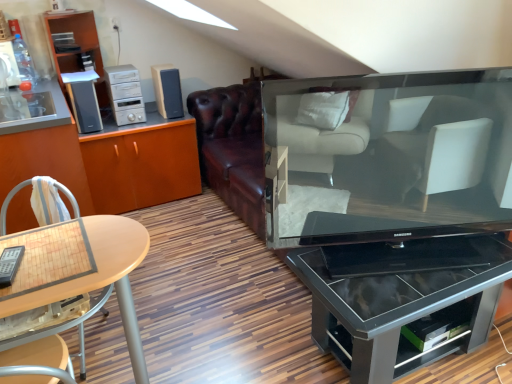
Locate an element on the screen. This screenshot has width=512, height=384. free point in front of black glossy television at center is located at coordinates (399, 283).